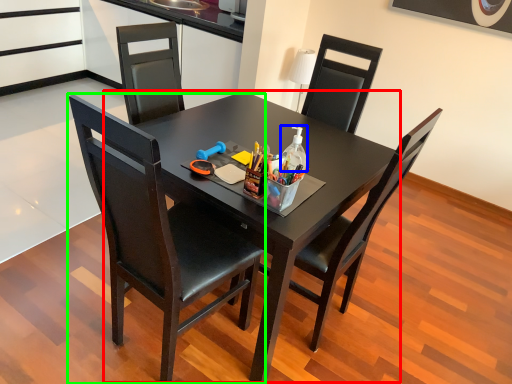
Question: Estimate the real-world distances between objects in this image. Which object is closer to round table (highlighted by a red box), bottle (highlighted by a blue box) or chair (highlighted by a green box)?

Choices:
 (A) bottle
 (B) chair

Answer: (B)